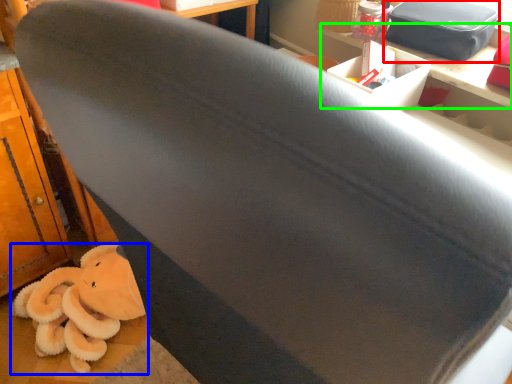
Question: Which is farther away from kit (highlighted by a red box)? toy (highlighted by a blue box) or table (highlighted by a green box)?

Choices:
 (A) toy
 (B) table

Answer: (A)